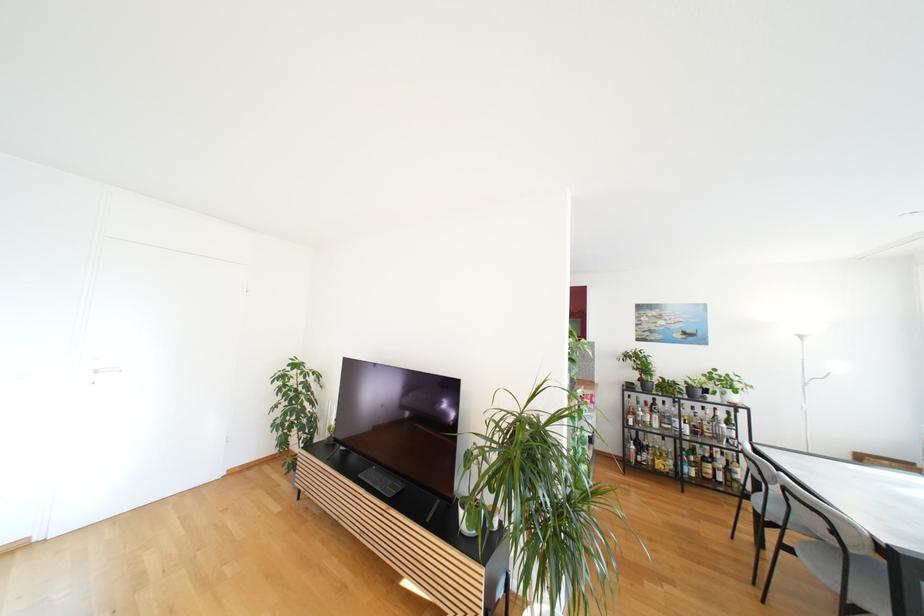
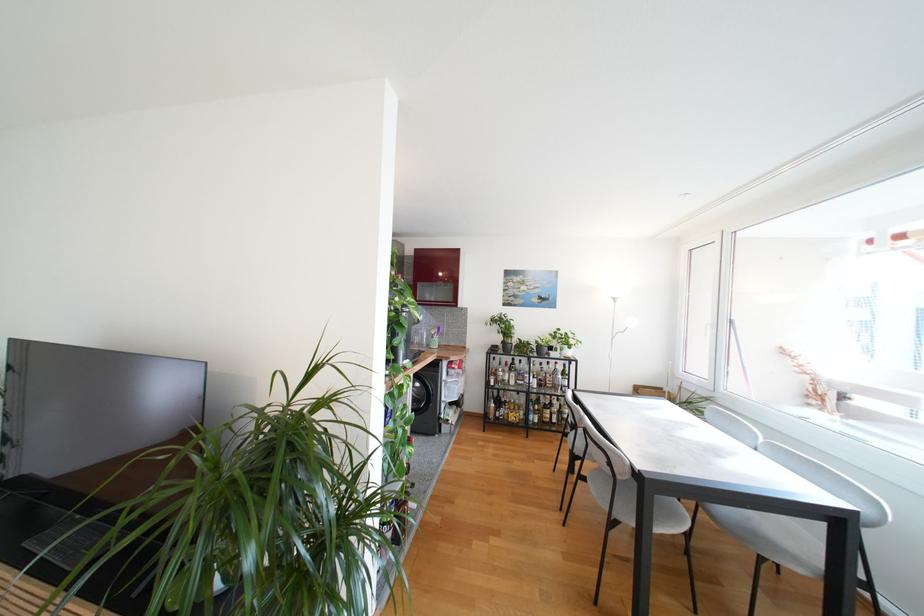
Question: Based on the continuous images, in which direction is the camera rotating? Reply with the corresponding letter.

Choices:
 (A) Left
 (B) Right
 (C) Up
 (D) Down

Answer: (B)